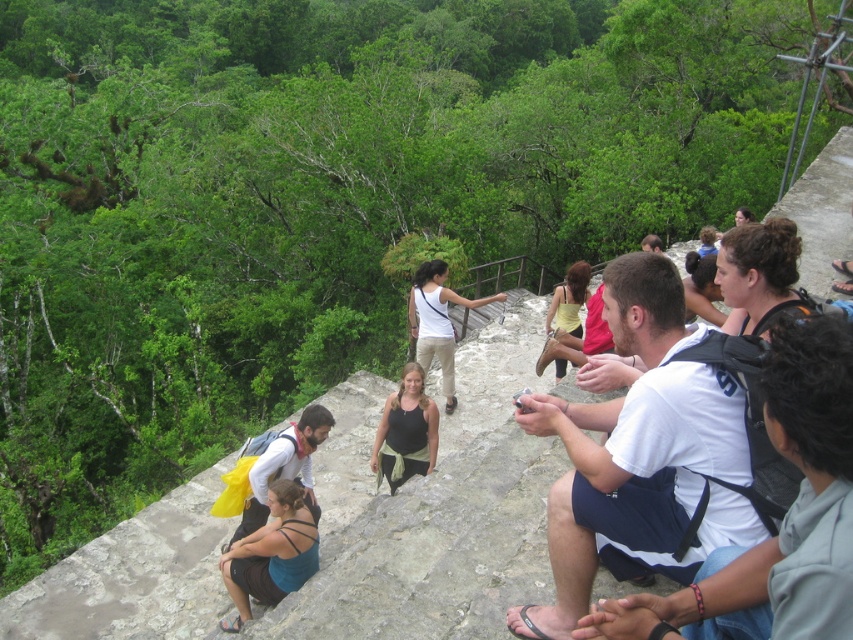
Question: Which point is closer to the camera taking this photo?

Choices:
 (A) (741, 282)
 (B) (291, 525)
 (C) (422, 323)
 (D) (305, 477)

Answer: (A)

Question: Which of the following is the closest to the observer?

Choices:
 (A) (704, 600)
 (B) (746, 305)

Answer: (A)

Question: Is black matte tank top at center smaller than matte white tank top at center?

Choices:
 (A) yes
 (B) no

Answer: (A)

Question: In this image, where is white cotton shirt at right located relative to yellow fabric dress at center?

Choices:
 (A) below
 (B) above

Answer: (A)

Question: Does brown hair at upper right appear under yellow fabric dress at center?

Choices:
 (A) no
 (B) yes

Answer: (B)

Question: Which point is farther to the camera?

Choices:
 (A) black matte tank top at center
 (B) teal fabric tank top at lower left

Answer: (A)